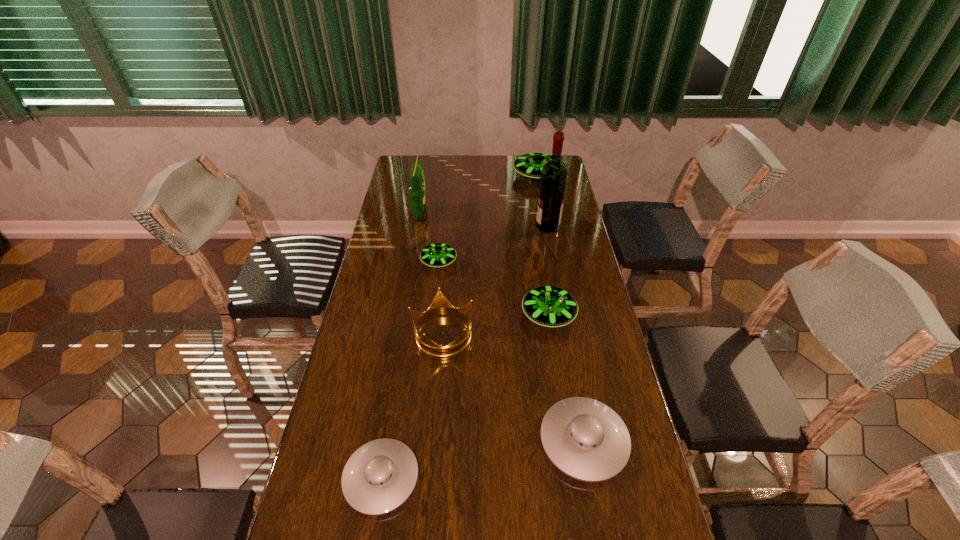
Identify the location of object identified as the seventh closest to the smaller gray saucer. (529, 165).

Choose which saucer is the third nearest neighbor to the fourth shortest saucer. Please provide its 2D coordinates. Your answer should be formatted as a tuple, i.e. [(x, y)], where the tuple contains the x and y coordinates of a point satisfying the conditions above.

[(379, 477)]

You are a GUI agent. You are given a task and a screenshot of the screen. Output one action in this format:
    pyautogui.click(x=<x>, y=<y>)
    Task: Click on the saucer that can be found as the second closest to the smallest green saucer
    The width and height of the screenshot is (960, 540).
    Given the screenshot: What is the action you would take?
    pyautogui.click(x=529, y=165)

You are a GUI agent. You are given a task and a screenshot of the screen. Output one action in this format:
    pyautogui.click(x=<x>, y=<y>)
    Task: Click on the green saucer object that ranks as the second closest to the right gray saucer
    
    Given the screenshot: What is the action you would take?
    pyautogui.click(x=436, y=255)

I want to click on the closest green saucer to the smallest green saucer, so click(x=549, y=306).

Find the location of a particular element. The width and height of the screenshot is (960, 540). gray saucer identified as the second closest to the tallest object is located at coordinates (379, 477).

Select which gray saucer is the second closest to the smallest green saucer. Please provide its 2D coordinates. Your answer should be formatted as a tuple, i.e. [(x, y)], where the tuple contains the x and y coordinates of a point satisfying the conditions above.

[(379, 477)]

At what (x,y) coordinates should I click in order to perform the action: click on vacant space that satisfies the following two spatial constraints: 1. on the front-facing side of the third nearest saucer; 2. on the left side of the crisp (potato chip). Please return your answer as a coordinate pair (x, y). This screenshot has height=540, width=960. Looking at the image, I should click on (402, 315).

Where is `vacant space that satisfies the following two spatial constraints: 1. on the front side of the second nearest green saucer; 2. on the right side of the second smallest green saucer`? Image resolution: width=960 pixels, height=540 pixels. vacant space that satisfies the following two spatial constraints: 1. on the front side of the second nearest green saucer; 2. on the right side of the second smallest green saucer is located at coordinates (433, 315).

This screenshot has height=540, width=960. Identify the location of free region that satisfies the following two spatial constraints: 1. on the front-facing side of the green crisp (potato chip); 2. on the back side of the third nearest saucer. (402, 315).